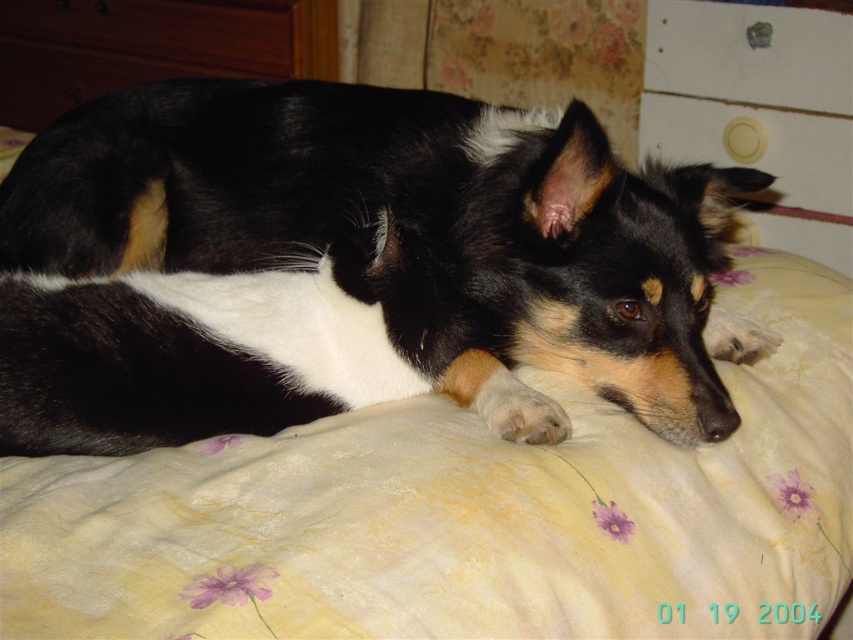
You are a small toy that is 12 inches long. You are placed on the bed and want to move from the yellow floral fabric at center to the black and white fur at center. Can you fit entirely between them without overlapping?

The distance between the yellow floral fabric at center and black and white fur at center is 10.11 inches. Since the toy is 12 inches long, it cannot fit entirely between them without overlapping.

You are a pet groomer observing the dog in the image. You notice the yellow floral fabric at center and the black and white fur at center. Which object is located underneath the other?

The yellow floral fabric at center is positioned under the black and white fur at center.

You are a photographer trying to capture the dog in the scene. You notice the yellow floral fabric at center and the black and white fur at center. Which object is closer to the camera, and why?

The yellow floral fabric at center is closer to the camera because it is positioned in front of the black and white fur at center.